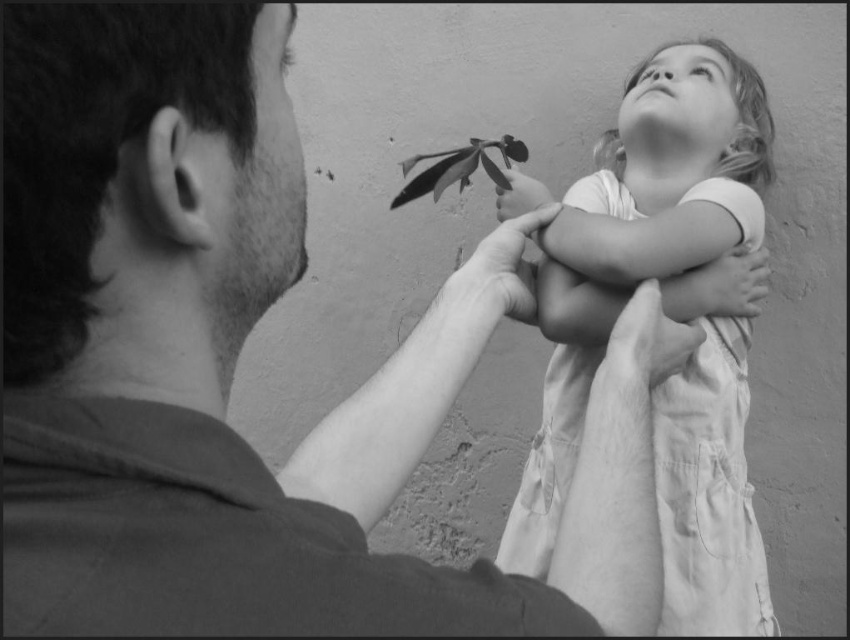
You are a photographer reviewing this black and white photo. You need to locate the white cotton dress at upper right. Where exactly is it positioned in the image?

The white cotton dress at upper right is positioned at point (639, 244).